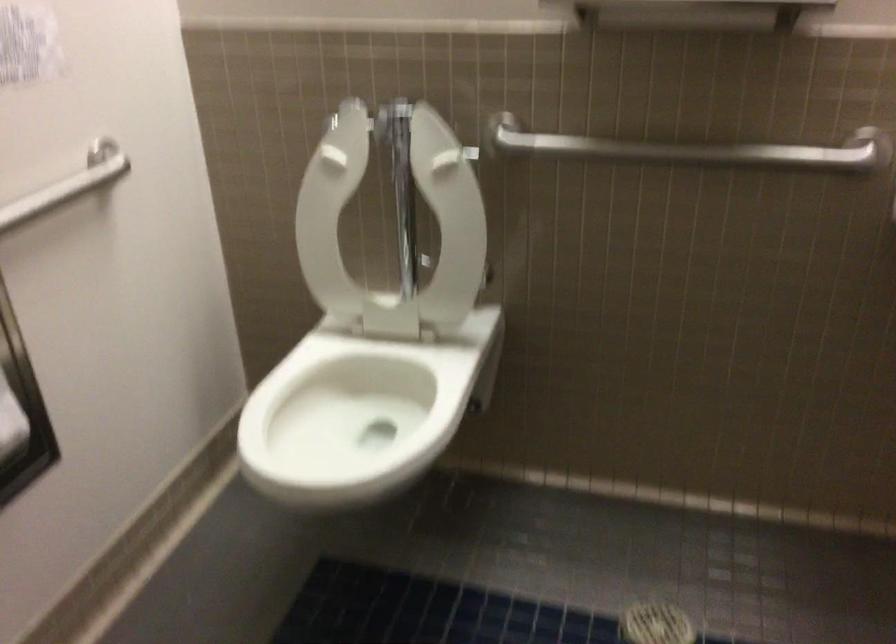
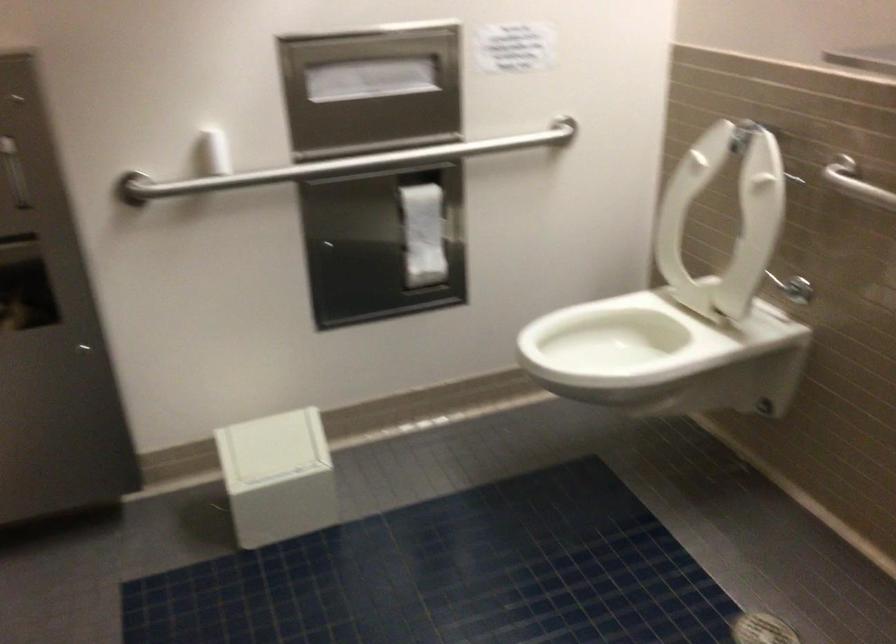
The point at (x=311, y=404) is marked in the first image. Where is the corresponding point in the second image?

(616, 336)